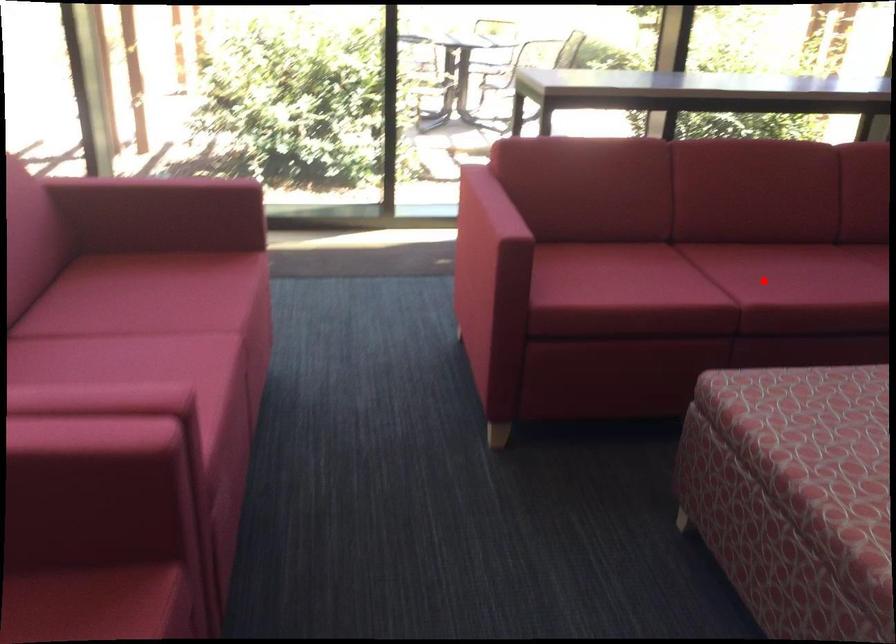
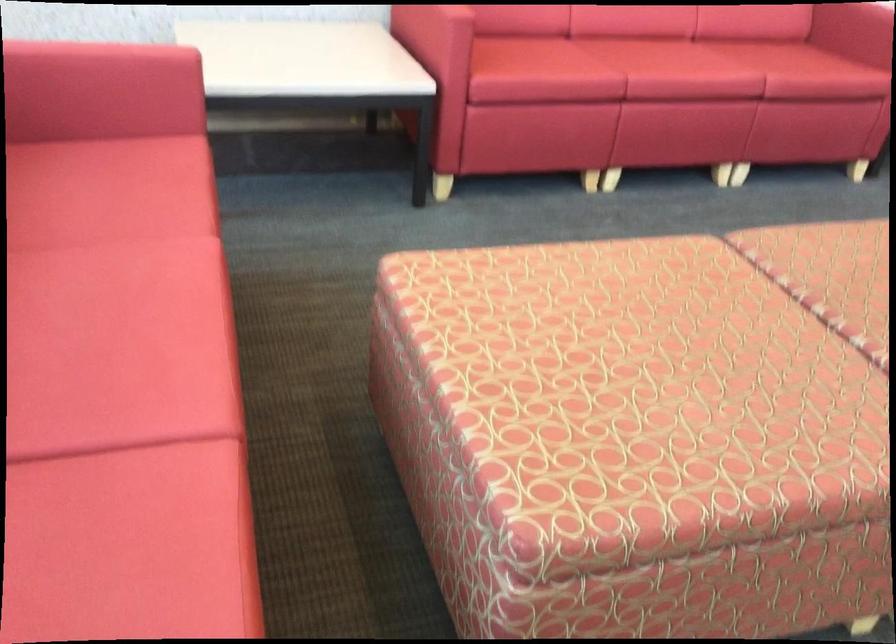
Find the pixel in the second image that matches the highlighted location in the first image.

(117, 381)